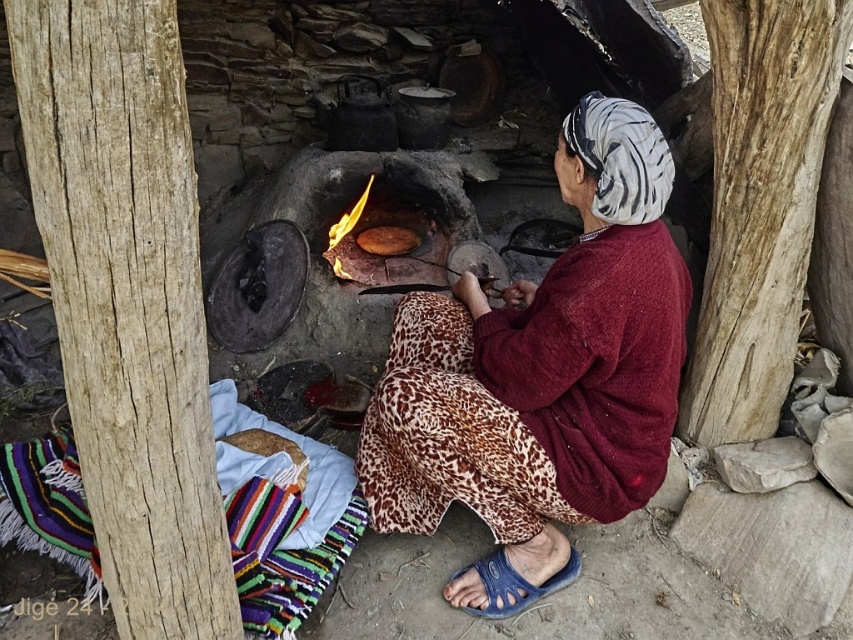
Question: Does maroon knitted sweater at center have a smaller size compared to brown matte flatbread at center?

Choices:
 (A) yes
 (B) no

Answer: (B)

Question: Which point is closer to the camera?

Choices:
 (A) maroon knitted sweater at center
 (B) brown matte flatbread at center

Answer: (A)

Question: Among these objects, which one is farthest from the camera?

Choices:
 (A) brown matte flatbread at center
 (B) maroon knitted sweater at center

Answer: (A)

Question: Can you confirm if maroon knitted sweater at center is positioned to the right of brown matte flatbread at center?

Choices:
 (A) no
 (B) yes

Answer: (B)

Question: Does maroon knitted sweater at center lie in front of brown matte flatbread at center?

Choices:
 (A) no
 (B) yes

Answer: (B)